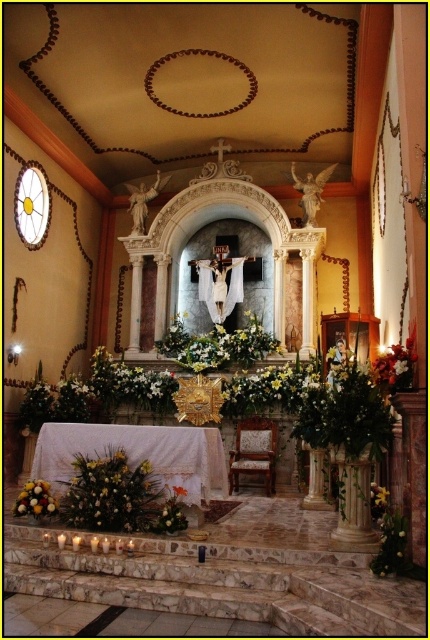
Question: Which object is farther from the camera taking this photo?

Choices:
 (A) white silk flowers at right
 (B) yellow matte floral arrangement at lower left
 (C) white floral arrangement at center

Answer: (C)

Question: Considering the relative positions of white silk flowers at right and yellow matte floral arrangement at lower left in the image provided, where is white silk flowers at right located with respect to yellow matte floral arrangement at lower left?

Choices:
 (A) above
 (B) below

Answer: (A)

Question: Which of the following is the farthest from the observer?

Choices:
 (A) yellow matte flower at lower center
 (B) yellow matte flower at lower right

Answer: (B)

Question: Does white silk flowers at right have a larger size compared to yellow matte floral arrangement at lower left?

Choices:
 (A) yes
 (B) no

Answer: (A)

Question: Is white floral arrangement at center further to the viewer compared to white silk flowers at right?

Choices:
 (A) yes
 (B) no

Answer: (A)

Question: Which point is closer to the camera?

Choices:
 (A) yellow matte floral arrangement at lower left
 (B) white silk flowers at right
 (C) yellow matte flower at lower right
 (D) white floral arrangement at center

Answer: (B)